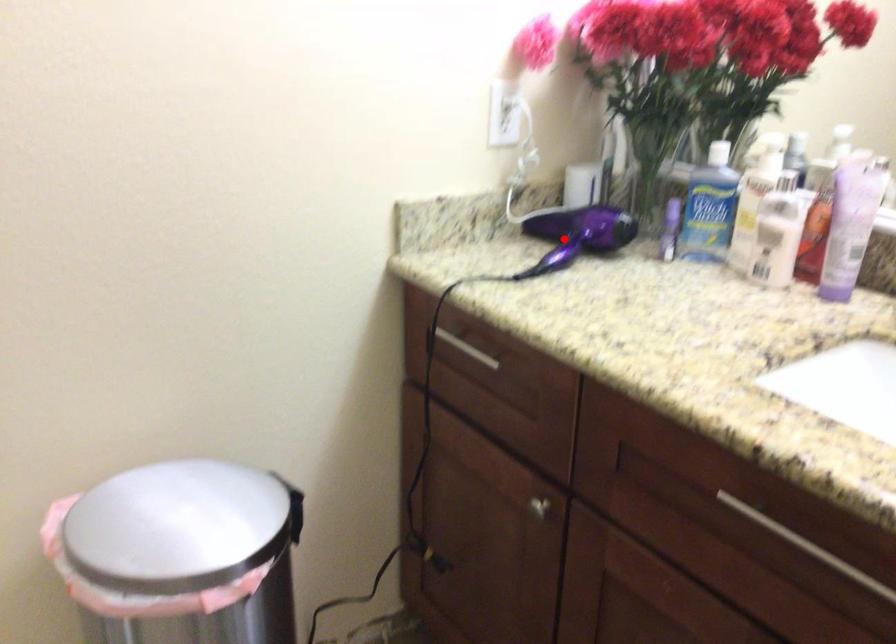
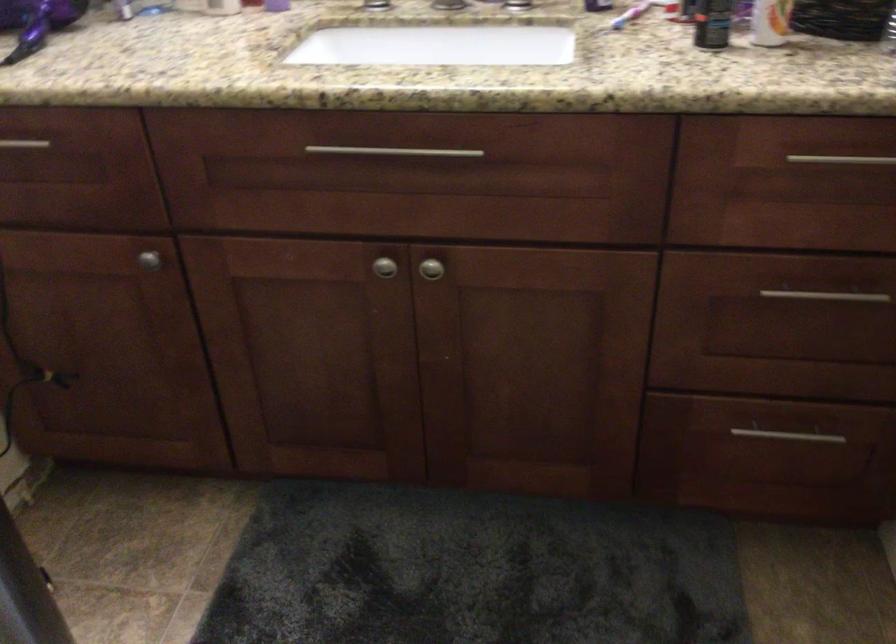
The point at the highlighted location is marked in the first image. Where is the corresponding point in the second image?

(37, 22)